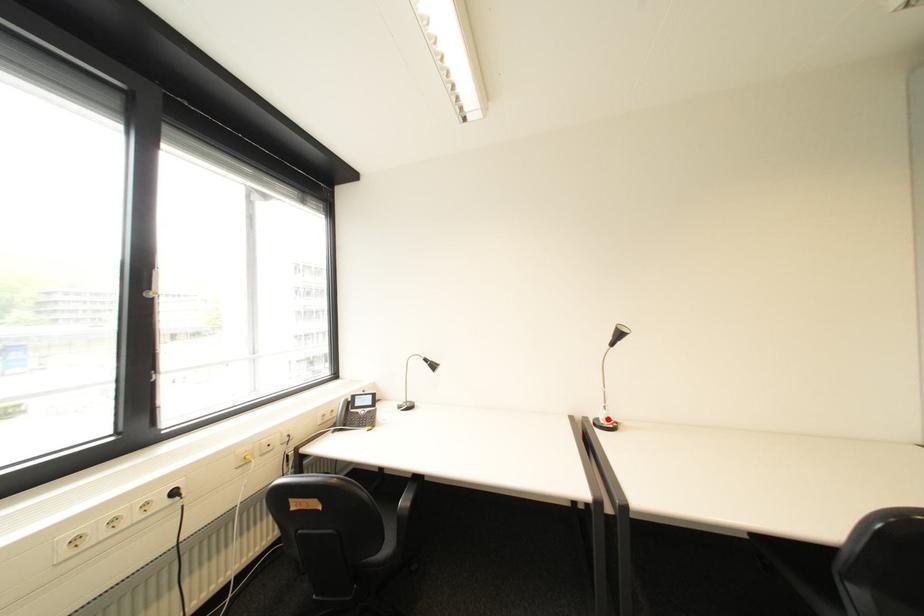
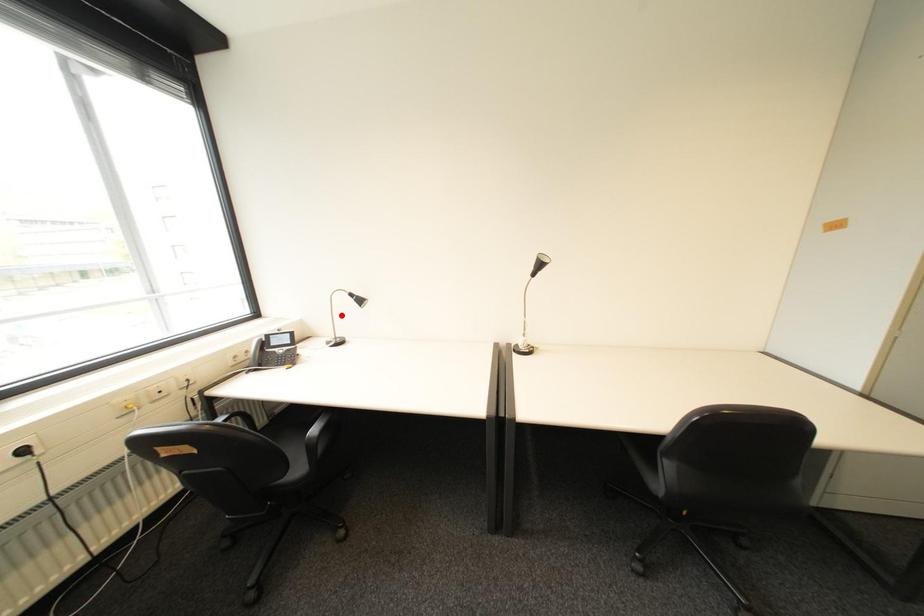
I am providing you with two images of the same scene from different viewpoints. A red point is marked on the first image and another point is marked on the second image. Does the point marked in image1 correspond to the same location as the one in image2?

No